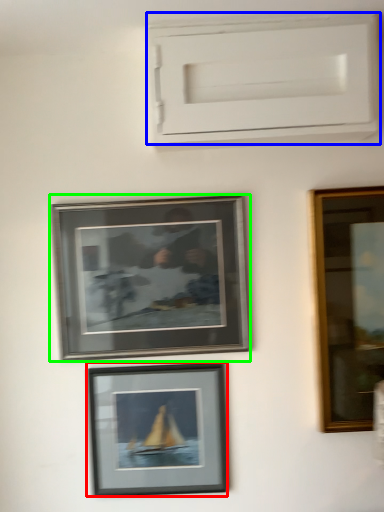
Question: Which object is the closest to the picture frame (highlighted by a red box)? Choose among these: window frame (highlighted by a blue box) or picture frame (highlighted by a green box).

Choices:
 (A) window frame
 (B) picture frame

Answer: (B)